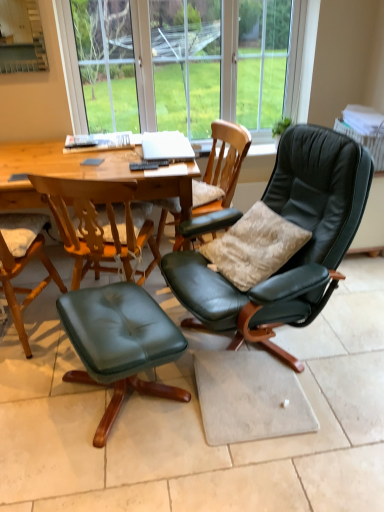
I want to click on free space in front of green leather ottoman at lower left, so [115, 471].